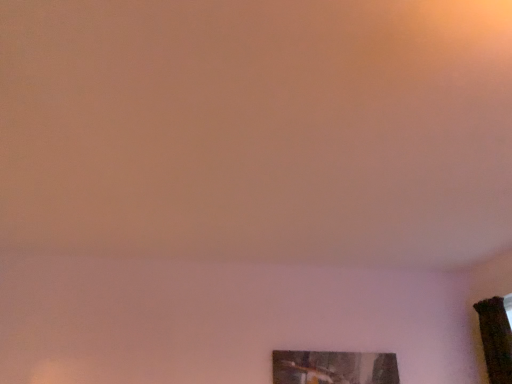
Image resolution: width=512 pixels, height=384 pixels. Describe the element at coordinates (334, 367) in the screenshot. I see `wooden picture frame at lower center` at that location.

Find the location of a particular element. wooden picture frame at lower center is located at coordinates (334, 367).

In order to click on wooden picture frame at lower center in this screenshot , I will do `click(334, 367)`.